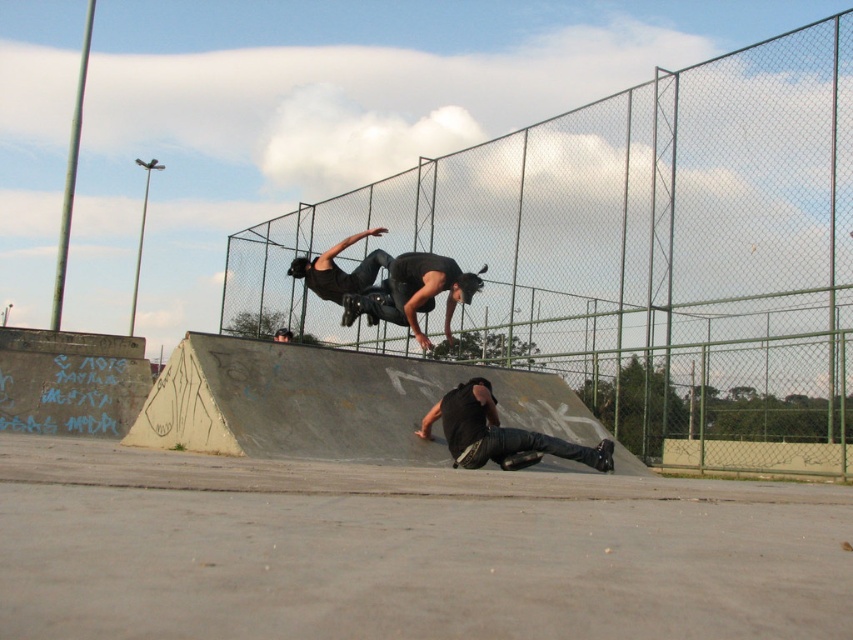
Question: Is green chain-link fence at upper center above black matte skateboarder at center?

Choices:
 (A) yes
 (B) no

Answer: (A)

Question: Which object appears farthest from the camera in this image?

Choices:
 (A) green chain-link fence at upper center
 (B) black matte pants at lower center
 (C) black rubber skateboard at center
 (D) black matte skateboarder at center

Answer: (C)

Question: Considering the real-world distances, which object is closest to the black matte skateboarder at center?

Choices:
 (A) black matte pants at lower center
 (B) green chain-link fence at upper center

Answer: (A)

Question: Can you confirm if black matte skateboarder at center is positioned below black matte pants at lower center?

Choices:
 (A) yes
 (B) no

Answer: (B)

Question: Can you confirm if green chain-link fence at upper center is thinner than black matte skateboarder at center?

Choices:
 (A) no
 (B) yes

Answer: (A)

Question: Which point is farther to the camera?

Choices:
 (A) (292, 268)
 (B) (430, 435)
 (C) (817, 406)

Answer: (A)